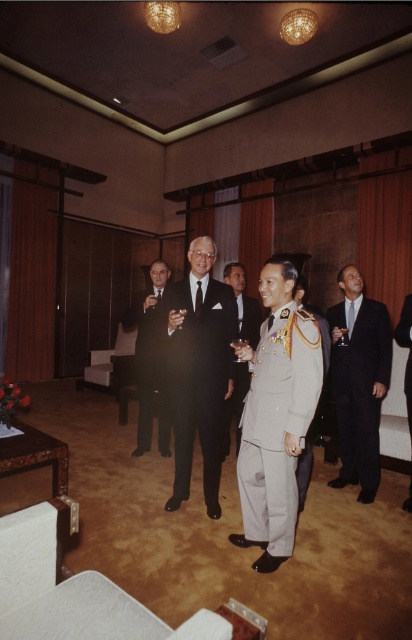
You are organizing a photo shoot and need to arrange two suits, the black satin suit at center and the shiny black suit at center, on a display stand. Given their sizes, which suit should you place on the smaller stand to ensure proper fitting?

The black satin suit at center should be placed on the smaller stand because it occupies less space than the shiny black suit at center.

You are attending this event and need to locate two men in black suits. The first is wearing a black satin suit at center, and the second is wearing a shiny black suit at center. According to the scene description, which one is positioned to the right of the other?

The black satin suit at center is to the right of the shiny black suit at center.

You are attending this formal event and need to locate the individual in the shiny black suit at center. According to the coordinates provided, where exactly would you find them in the room?

The shiny black suit at center is located at point coordinates 0.567 on the x axis and 0.364 on the y axis, so you can find them at that specific coordinate position in the room.